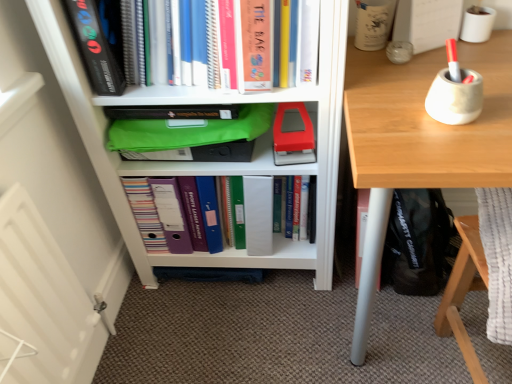
The image size is (512, 384). I want to click on vacant point to the right of matte gray pen holder at upper right, which is the 3th stationery from left to right, so click(x=496, y=100).